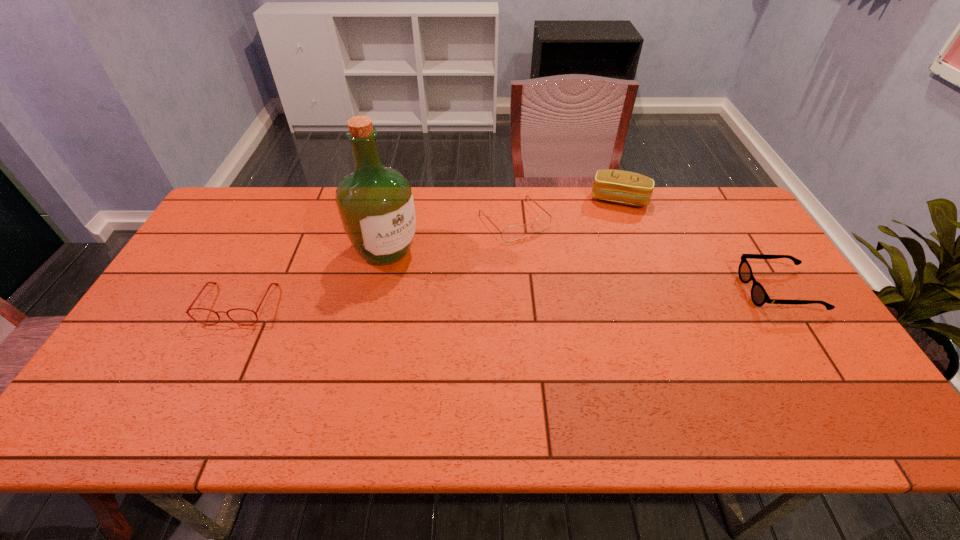
Locate an element on the screen. free spot located on the zipper side of the second tallest object is located at coordinates (594, 279).

Locate an element on the screen. The image size is (960, 540). spectacles positioned at the far edge is located at coordinates (512, 233).

The height and width of the screenshot is (540, 960). Identify the location of liquor that is at the far edge. point(375,203).

The height and width of the screenshot is (540, 960). I want to click on clutch bag present at the far edge, so click(x=618, y=186).

This screenshot has height=540, width=960. I want to click on object at the left edge, so click(x=207, y=283).

Where is `object present at the right edge`? Image resolution: width=960 pixels, height=540 pixels. object present at the right edge is located at coordinates (759, 296).

In the image, there is a desktop. Identify the location of blank space at the far edge. (585, 206).

You are a GUI agent. You are given a task and a screenshot of the screen. Output one action in this format:
    pyautogui.click(x=<x>, y=<y>)
    Task: Click on the vacant area at the near edge of the desktop
    
    Given the screenshot: What is the action you would take?
    pyautogui.click(x=318, y=386)

In the image, there is a desktop. Where is `vacant space at the left edge`? vacant space at the left edge is located at coordinates click(x=233, y=234).

In the image, there is a desktop. In order to click on vacant space at the right edge in this screenshot , I will do `click(780, 326)`.